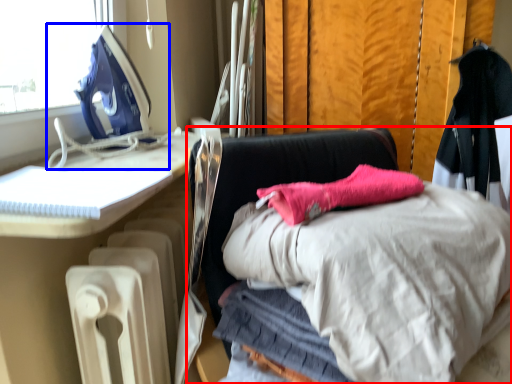
Question: Among these objects, which one is nearest to the camera, furniture (highlighted by a red box) or sewing machine (highlighted by a blue box)?

Choices:
 (A) furniture
 (B) sewing machine

Answer: (A)